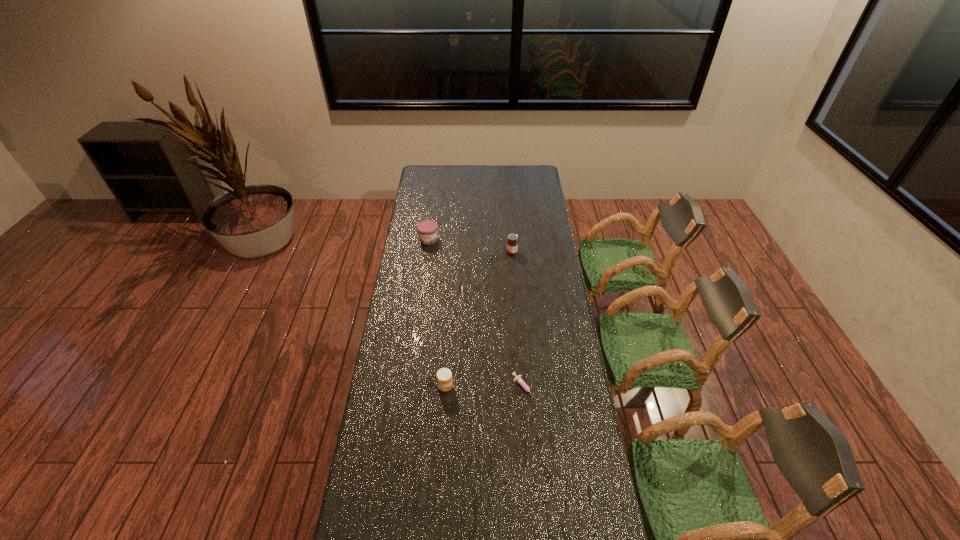
This screenshot has height=540, width=960. What are the coordinates of `free space located 0.120m on the front label of the farthest object` in the screenshot? It's located at (425, 262).

Where is `blank space located on the front label of the nearest jam`? The height and width of the screenshot is (540, 960). blank space located on the front label of the nearest jam is located at coordinates (485, 387).

At what (x,y) coordinates should I click in order to perform the action: click on vacant space situated 0.290m on the back of the syringe. Please return your answer as a coordinate pair (x, y). This screenshot has width=960, height=540. Looking at the image, I should click on (518, 317).

The height and width of the screenshot is (540, 960). What are the coordinates of `object at the left edge` in the screenshot? It's located at pyautogui.click(x=427, y=230).

Image resolution: width=960 pixels, height=540 pixels. Find the location of `vacant space at the far edge of the desktop`. vacant space at the far edge of the desktop is located at coordinates (479, 168).

You are a GUI agent. You are given a task and a screenshot of the screen. Output one action in this format:
    pyautogui.click(x=<x>, y=<y>)
    Task: Click on the vacant space at the left edge of the desktop
    This screenshot has width=960, height=540.
    Given the screenshot: What is the action you would take?
    pyautogui.click(x=415, y=366)

This screenshot has width=960, height=540. In the image, there is a desktop. In order to click on free space at the right edge in this screenshot , I will do `click(601, 497)`.

Identify the location of free space at the far left corner of the desktop. This screenshot has width=960, height=540. (439, 168).

You are a GUI agent. You are given a task and a screenshot of the screen. Output one action in this format:
    pyautogui.click(x=<x>, y=<y>)
    Task: Click on the free space at the far right corner of the desktop
    This screenshot has width=960, height=540.
    Given the screenshot: What is the action you would take?
    pyautogui.click(x=530, y=180)

This screenshot has height=540, width=960. Identify the location of free space between the second jam from right to left and the second farthest jam. (478, 320).